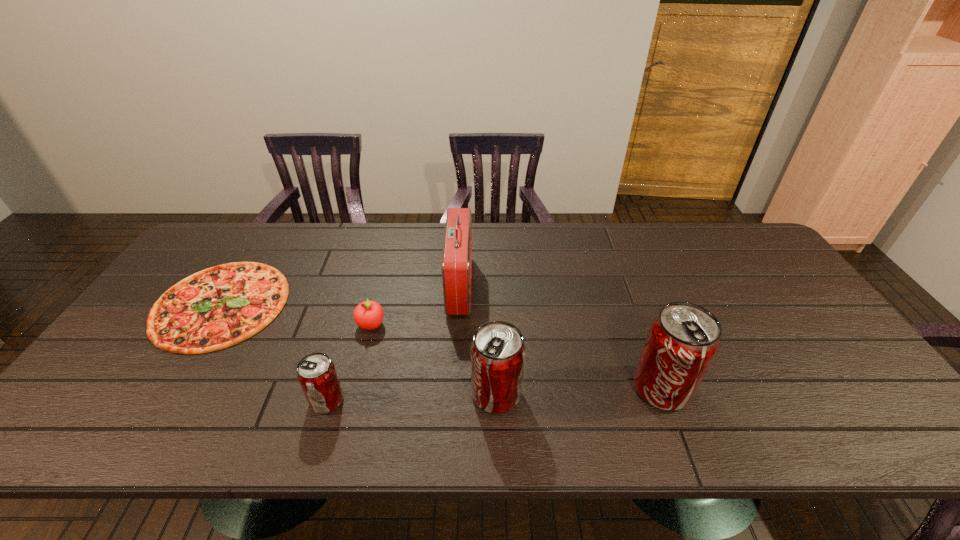
Locate an element on the screen. vacant space at the right edge of the desktop is located at coordinates (788, 321).

What are the coordinates of `vacant space at the near left corner of the desktop` in the screenshot? It's located at (85, 393).

Identify the location of vacant region at the far right corner of the desktop. The width and height of the screenshot is (960, 540). (727, 244).

Locate an element on the screen. This screenshot has height=540, width=960. free spot between the third tallest object and the pizza is located at coordinates (358, 349).

This screenshot has height=540, width=960. In order to click on free space between the third shortest object and the third object from right to left in this screenshot , I will do `click(394, 343)`.

You are a GUI agent. You are given a task and a screenshot of the screen. Output one action in this format:
    pyautogui.click(x=<x>, y=<y>)
    Task: Click on the free spot between the shortest pop soda and the first-aid kit
    This screenshot has height=540, width=960.
    Given the screenshot: What is the action you would take?
    pyautogui.click(x=394, y=343)

Where is `free space between the shortest object and the third object from right to left`? free space between the shortest object and the third object from right to left is located at coordinates (340, 295).

Identify the location of free space between the fourth tallest object and the leftmost object. Image resolution: width=960 pixels, height=540 pixels. (274, 352).

This screenshot has height=540, width=960. Find the location of `free space between the fifth object from left to right and the pizza`. free space between the fifth object from left to right and the pizza is located at coordinates point(358,349).

Image resolution: width=960 pixels, height=540 pixels. What are the coordinates of `free point between the leftmost pop soda and the second pop soda from left to right` in the screenshot? It's located at (412, 397).